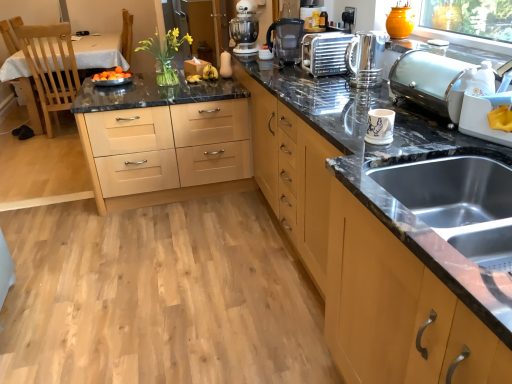
Question: Considering the positions of white ceramic mug at upper right, placed as the third appliance when sorted from back to front, and wooden table at left in the image, is white ceramic mug at upper right, placed as the third appliance when sorted from back to front, taller or shorter than wooden table at left?

Choices:
 (A) short
 (B) tall

Answer: (A)

Question: Considering the positions of white ceramic mug at upper right, placed as the third appliance when sorted from back to front, and wooden table at left in the image, is white ceramic mug at upper right, placed as the third appliance when sorted from back to front, bigger or smaller than wooden table at left?

Choices:
 (A) small
 (B) big

Answer: (A)

Question: Which object is the closest to the satin silver toaster at upper center, the 3th appliance viewed from the right?

Choices:
 (A) black plastic coffee machine at center
 (B) matte brown cabinet at lower right
 (C) matte wood chest of drawers at center
 (D) shiny metallic kettle at upper right
 (E) satin silver toaster at upper right, which is the 1th appliance in right-to-left order

Answer: (D)

Question: Which object is the closest to the matte brown cabinet at lower right?

Choices:
 (A) satin silver toaster at upper right, the 2th appliance in the back-to-front sequence
 (B) white matte stand mixer at center
 (C) white ceramic mug at upper right, the first appliance from the front
 (D) matte wood chest of drawers at center
 (E) satin silver toaster at upper center, the 1th appliance when ordered from back to front

Answer: (C)